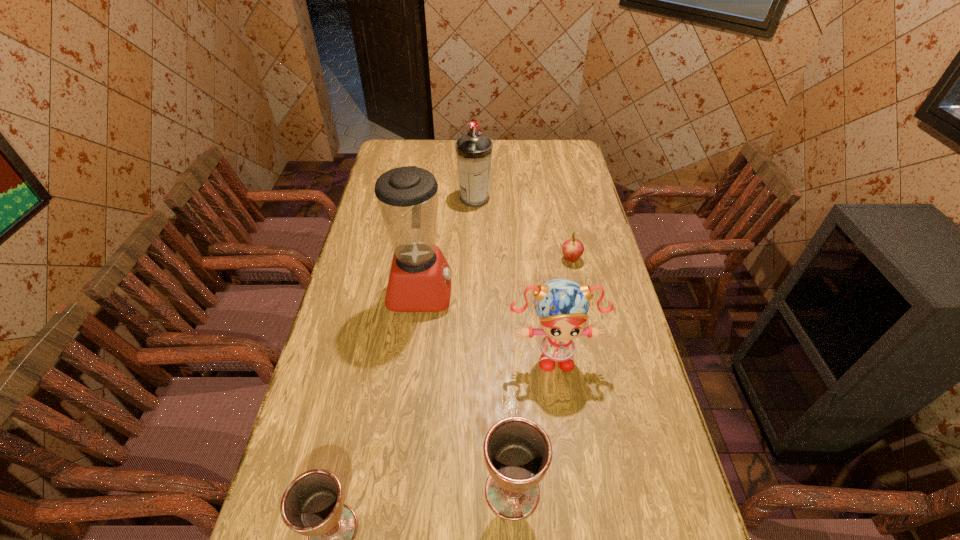
The width and height of the screenshot is (960, 540). I want to click on free location located 0.080m on the right of the farthest object, so click(x=511, y=199).

Locate an element on the screen. The height and width of the screenshot is (540, 960). vacant region located 0.390m on the back of the shortest object is located at coordinates (557, 191).

What are the coordinates of `vacant area located on the face of the fourth shortest object` in the screenshot? It's located at (570, 478).

The width and height of the screenshot is (960, 540). In order to click on object that is at the near edge in this screenshot , I will do `click(518, 452)`.

In order to click on object present at the left edge in this screenshot , I will do `click(420, 277)`.

The width and height of the screenshot is (960, 540). Identify the location of apple at the right edge. click(x=572, y=249).

At what (x,y) coordinates should I click in order to perform the action: click on doll situated at the right edge. Please return your answer as a coordinate pair (x, y). The width and height of the screenshot is (960, 540). Looking at the image, I should click on (562, 304).

This screenshot has height=540, width=960. In the image, there is a desktop. What are the coordinates of `vacant space at the far edge` in the screenshot? It's located at (540, 163).

Locate an element on the screen. vacant region at the left edge is located at coordinates (331, 373).

This screenshot has height=540, width=960. I want to click on vacant space at the right edge of the desktop, so coord(625,334).